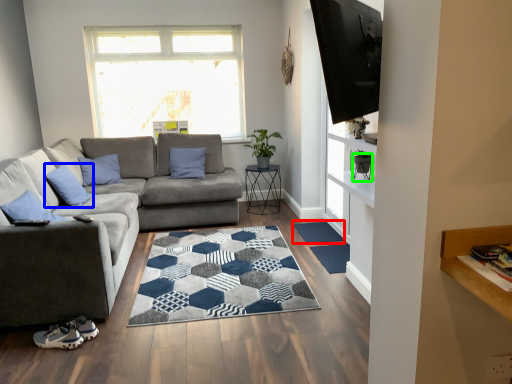
Question: Estimate the real-world distances between objects in this image. Which object is farther from doormat (highlighted by a red box), pillow (highlighted by a blue box) or chair (highlighted by a green box)?

Choices:
 (A) pillow
 (B) chair

Answer: (A)